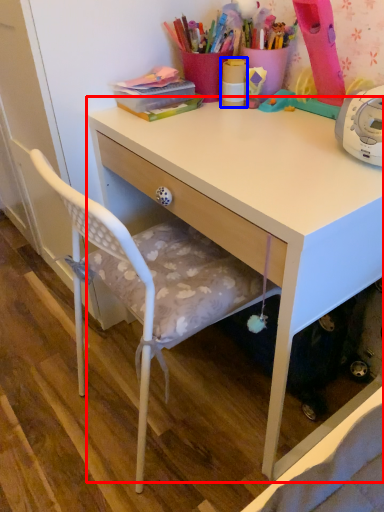
Question: Which point is further to the camera, desk (highlighted by a red box) or office supplies (highlighted by a blue box)?

Choices:
 (A) desk
 (B) office supplies

Answer: (B)